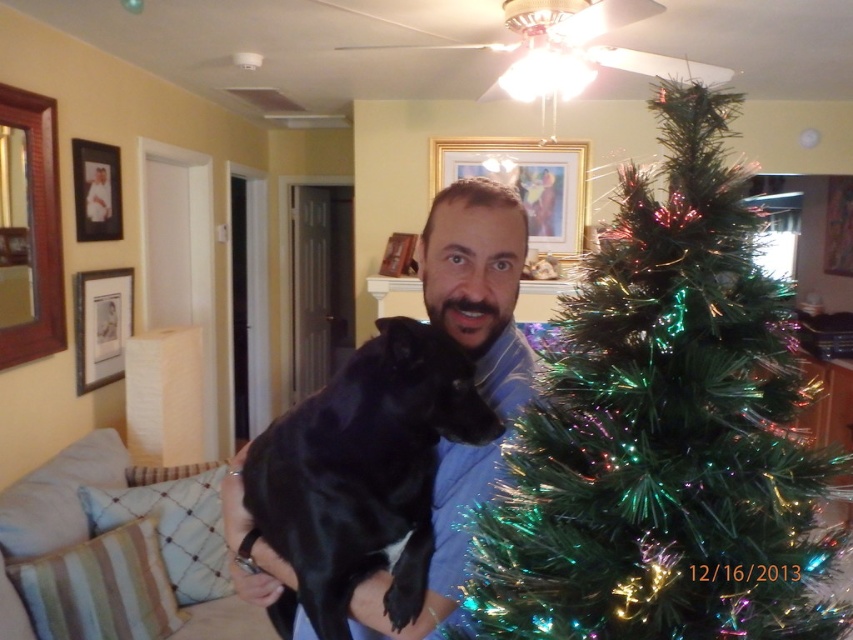
Is iridescent green artificial tree at right smaller than black shiny dog at center?

No, iridescent green artificial tree at right is not smaller than black shiny dog at center.

Can you confirm if iridescent green artificial tree at right is positioned above black shiny dog at center?

Correct, iridescent green artificial tree at right is located above black shiny dog at center.

The height and width of the screenshot is (640, 853). What are the coordinates of `iridescent green artificial tree at right` in the screenshot? It's located at (663, 429).

Where is `iridescent green artificial tree at right`? Image resolution: width=853 pixels, height=640 pixels. iridescent green artificial tree at right is located at coordinates (663, 429).